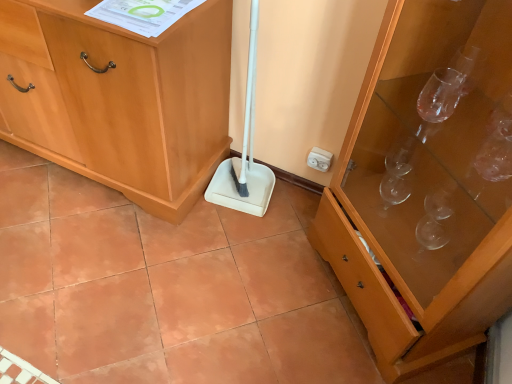
Find the location of a particular element. unoccupied region to the right of white plastic shovel at center is located at coordinates (290, 205).